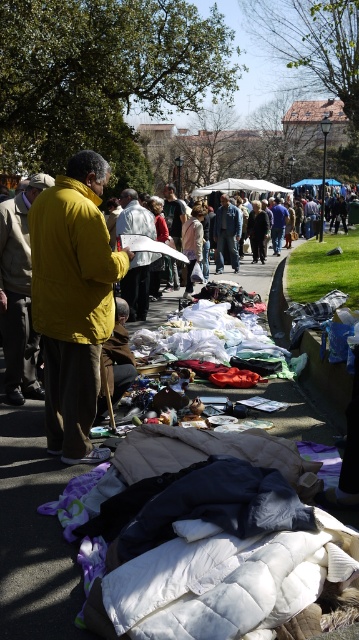
Question: Which point is closer to the camera taking this photo?

Choices:
 (A) (98, 209)
 (B) (22, 406)

Answer: (A)

Question: Does yellow matte jacket at left have a larger size compared to white quilted mattress at center?

Choices:
 (A) yes
 (B) no

Answer: (A)

Question: In this image, where is yellow matte jacket at left located relative to white quilted mattress at center?

Choices:
 (A) above
 (B) below

Answer: (A)

Question: Among these points, which one is nearest to the camera?

Choices:
 (A) (x=94, y=259)
 (B) (x=28, y=509)

Answer: (B)

Question: Can you confirm if yellow matte jacket at left is bigger than white quilted mattress at center?

Choices:
 (A) no
 (B) yes

Answer: (B)